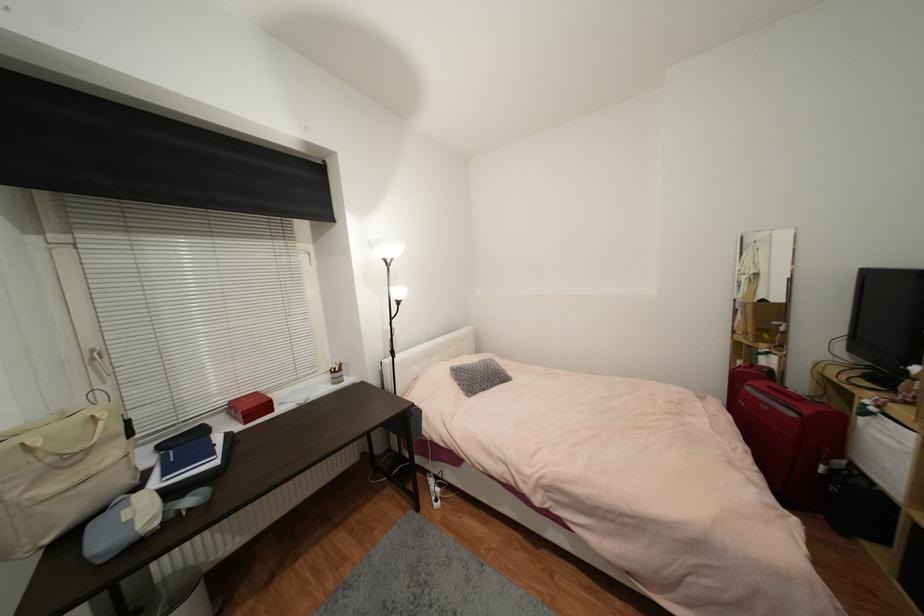
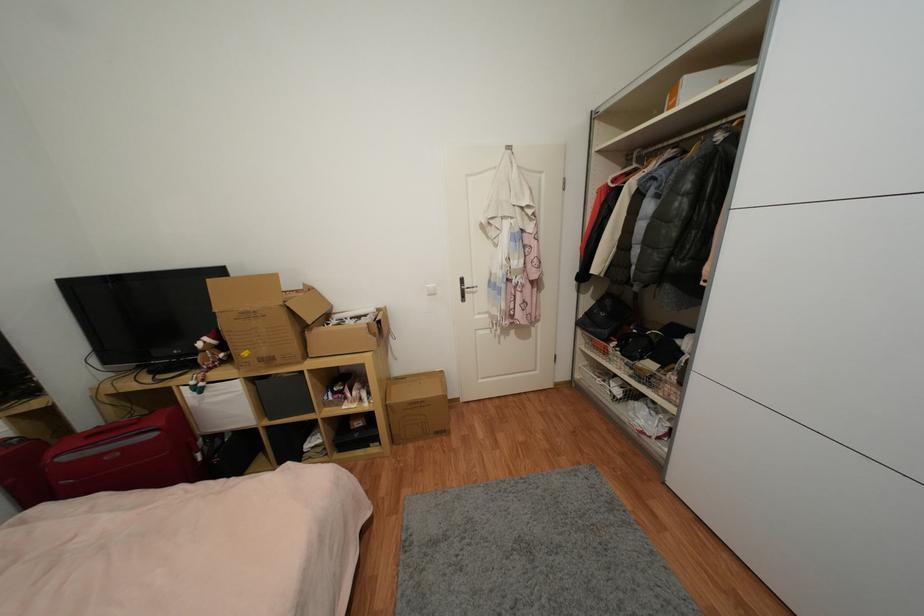
Locate, in the second image, the point that corresponds to [878,411] in the first image.

(205, 386)